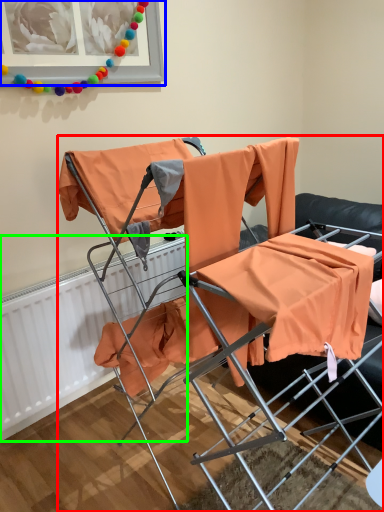
Question: Which object is the farthest from chair (highlighted by a red box)? Choose among these: picture frame (highlighted by a blue box) or radiator (highlighted by a green box).

Choices:
 (A) picture frame
 (B) radiator

Answer: (A)